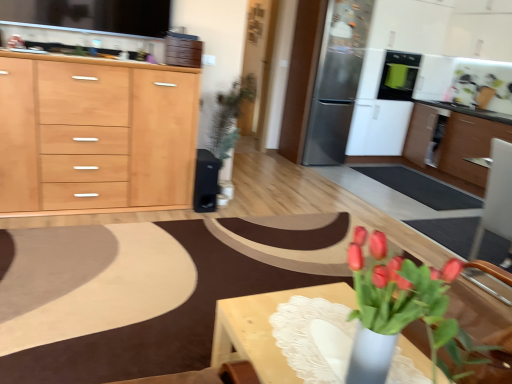
Question: From a real-world perspective, is light wood/texture cabinet at left, the 2th cabinetry in the back-to-front sequence, above or below wooden countertop at upper center?

Choices:
 (A) below
 (B) above

Answer: (A)

Question: Is light wood/texture cabinet at left, which is counted as the 1th cabinetry, starting from the front, to the left or to the right of wooden countertop at upper center in the image?

Choices:
 (A) right
 (B) left

Answer: (B)

Question: Based on their relative distances, which object is nearer to the wooden cabinet at right, the 1th cabinetry from the right?

Choices:
 (A) stainless steel refrigerator at upper right
 (B) black glossy oven at upper right, which appears as the 1th appliance when viewed from the right
 (C) wooden countertop at upper center
 (D) light wood/texture cabinet at left, which is counted as the 1th cabinetry, starting from the left
 (E) satin silver refrigerator at upper right, arranged as the second appliance when viewed from the left

Answer: (B)

Question: Which object is positioned closest to the satin silver refrigerator at upper right, arranged as the second appliance when viewed from the left?

Choices:
 (A) light wood/texture cabinet at left, which is counted as the 1th cabinetry, starting from the left
 (B) matte pink tulips at lower right
 (C) wooden cabinet at right, which ranks as the second cabinetry in front-to-back order
 (D) wooden countertop at upper center
 (E) black matte speaker at center, the third appliance positioned from the right

Answer: (C)